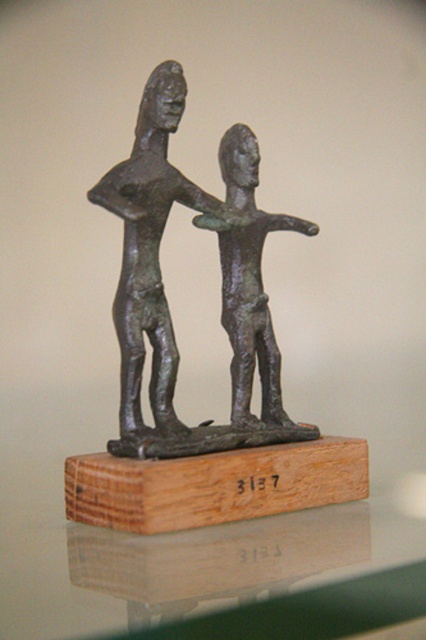
Question: Which of the following is the farthest from the observer?

Choices:
 (A) (224, 560)
 (B) (169, 369)
 (C) (230, 156)

Answer: (C)

Question: Does bronze statue at center come behind bronze figure at center?

Choices:
 (A) yes
 (B) no

Answer: (B)

Question: Among these objects, which one is nearest to the camera?

Choices:
 (A) bronze statue at center
 (B) bronze figure at center

Answer: (A)

Question: Estimate the real-world distances between objects in this image. Which object is closer to the bronze statue at center?

Choices:
 (A) transparent glass table at center
 (B) bronze figure at center

Answer: (B)

Question: Can you confirm if transparent glass table at center is smaller than bronze figure at center?

Choices:
 (A) no
 (B) yes

Answer: (A)

Question: Does transparent glass table at center appear on the right side of bronze statue at center?

Choices:
 (A) no
 (B) yes

Answer: (B)